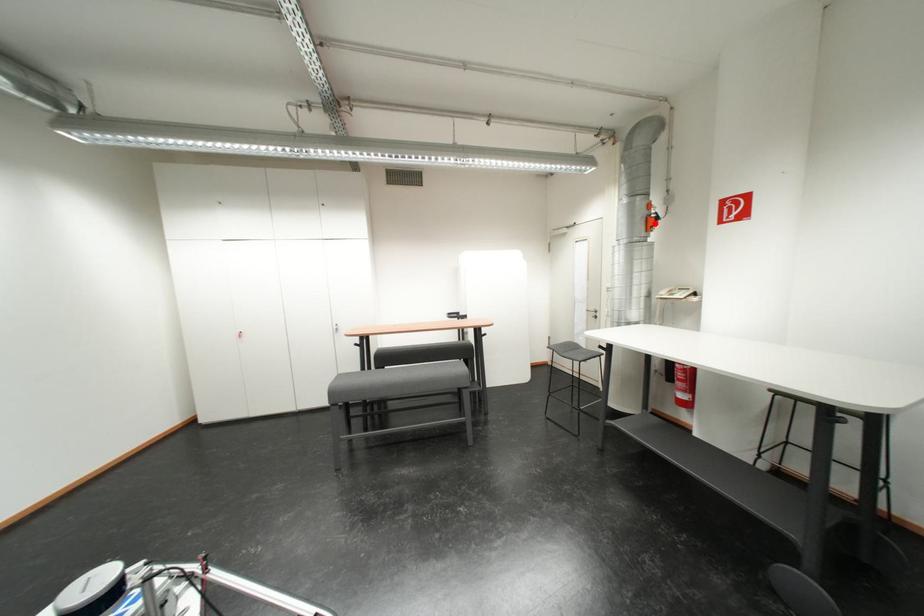
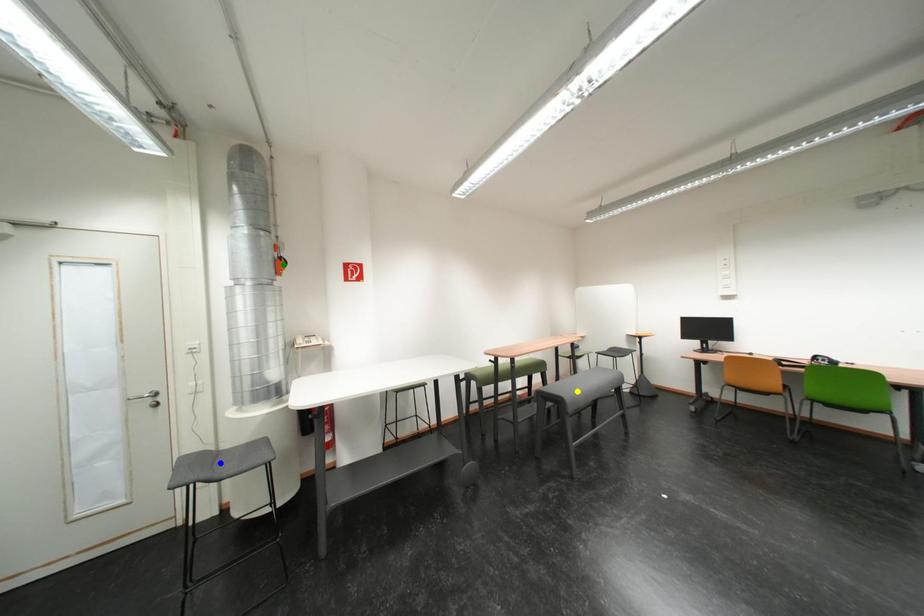
Question: I am providing you with two images of the same scene from different viewpoints. A red point is marked on the first image. You are given multiple points on the second image. Which point in image 2 is actually the same real-world point as the red point in image 1?

Choices:
 (A) green point
 (B) yellow point
 (C) blue point

Answer: (A)